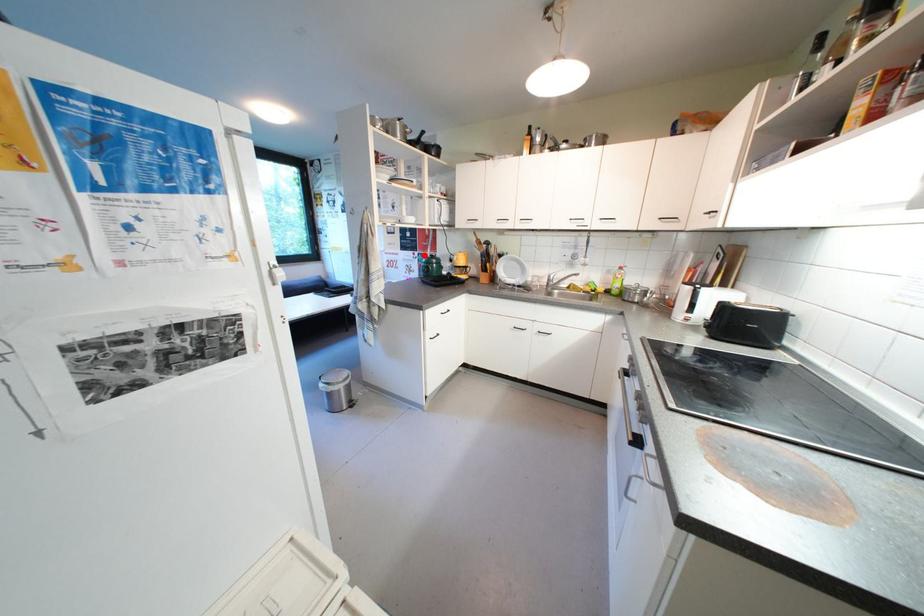
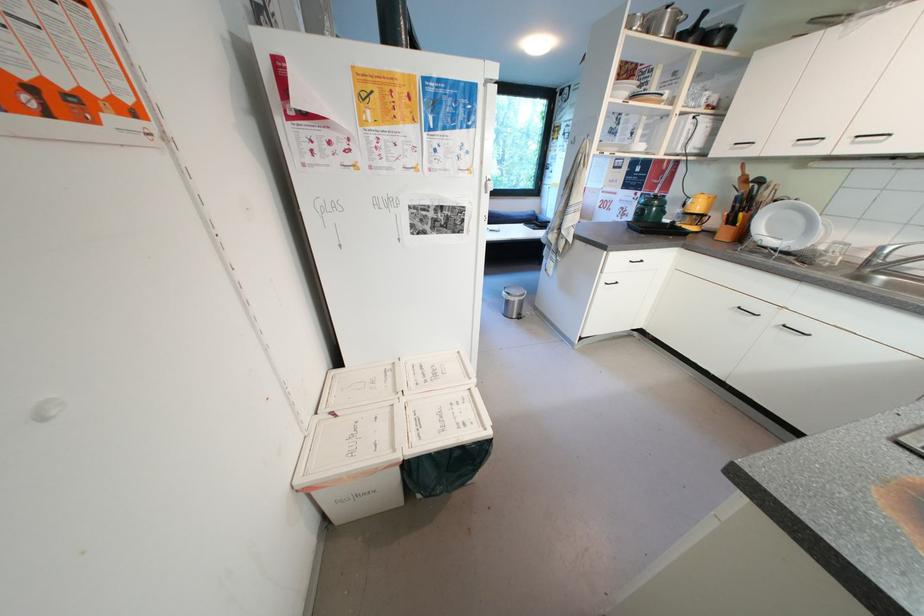
In the second image, find the point that corresponds to the highlighted location in the first image.

(647, 196)